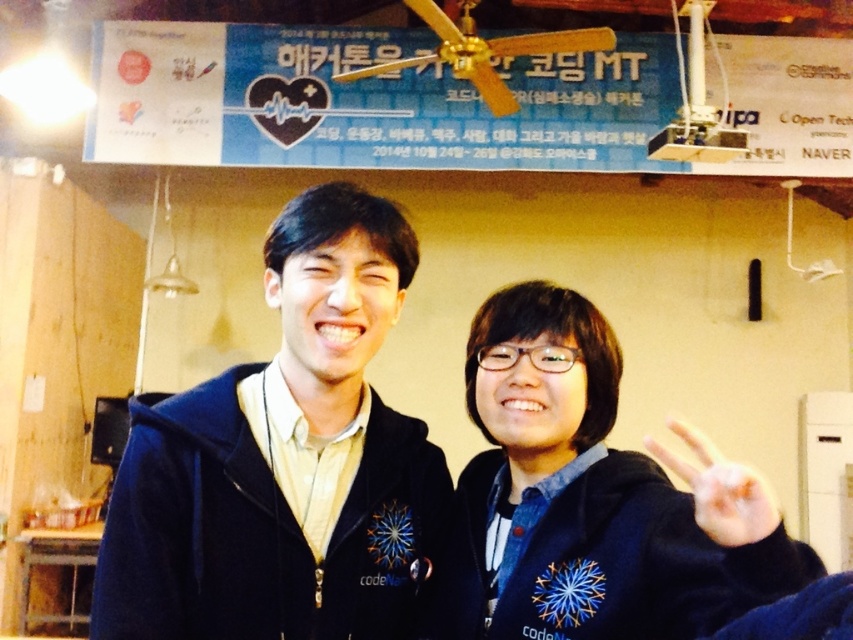
Question: Which of the following is the closest to the observer?

Choices:
 (A) (374, 484)
 (B) (306, 493)

Answer: (B)

Question: Which object is the closest to the matte black hoodie at center?

Choices:
 (A) navy blue hoodie at center
 (B) white matte hand at center right

Answer: (A)

Question: Is matte black hoodie at center above white matte hand at center right?

Choices:
 (A) no
 (B) yes

Answer: (B)

Question: Which point is farther from the camera taking this photo?

Choices:
 (A) (409, 481)
 (B) (733, 536)

Answer: (A)

Question: Can you confirm if navy blue hoodie at center is positioned above matte black hoodie at center?

Choices:
 (A) no
 (B) yes

Answer: (A)

Question: Considering the relative positions of matte black hoodie at center and white matte hand at center right in the image provided, where is matte black hoodie at center located with respect to white matte hand at center right?

Choices:
 (A) above
 (B) below

Answer: (A)